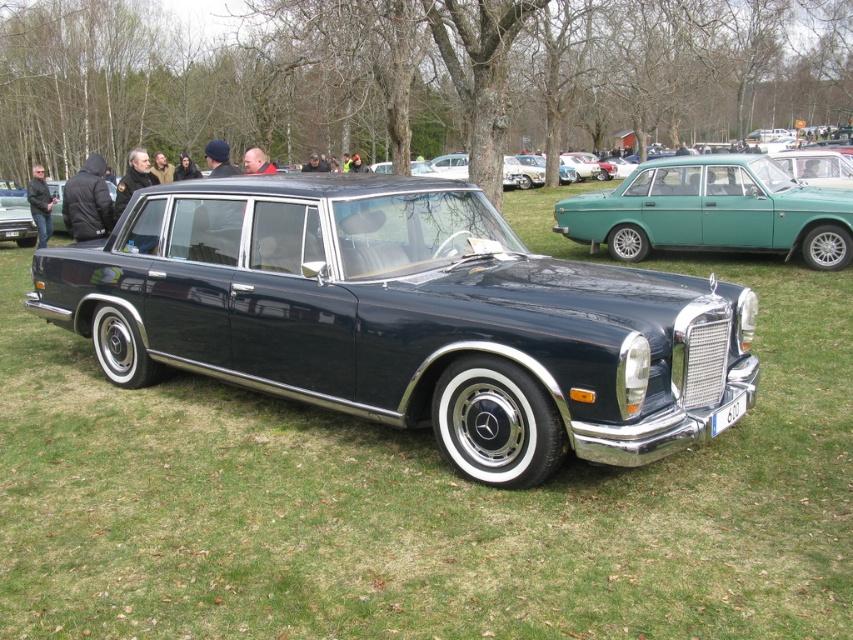
You are a photographer at a car show and need to capture both the black jacket at left and the black leather jacket at left in your shot. Which jacket is closer to the camera?

The black jacket at left is positioned under the black leather jacket at left, so the black leather jacket at left is closer to the camera.

You are a photographer at a car show and want to capture both the black jacket at left and the black leather jacket at left in your photo. Which jacket is positioned closer to the camera?

The black jacket at left is closer to the viewer than the black leather jacket at left, so the black jacket at left will appear closer to the camera in the photo.

You are at the car show and want to pick up the black jacket at left. Where should you look to find it?

The black jacket at left is located at point (86, 202).